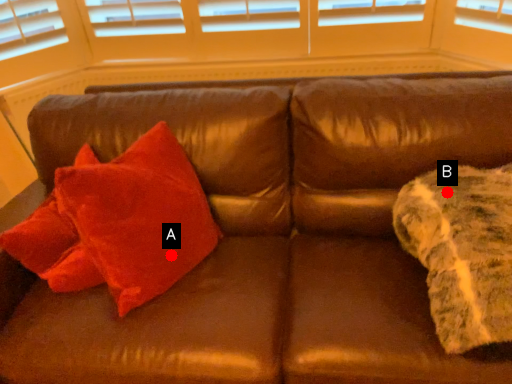
Question: Two points are circled on the image, labeled by A and B beside each circle. Which of the following is the closest to the observer?

Choices:
 (A) A is closer
 (B) B is closer

Answer: (B)